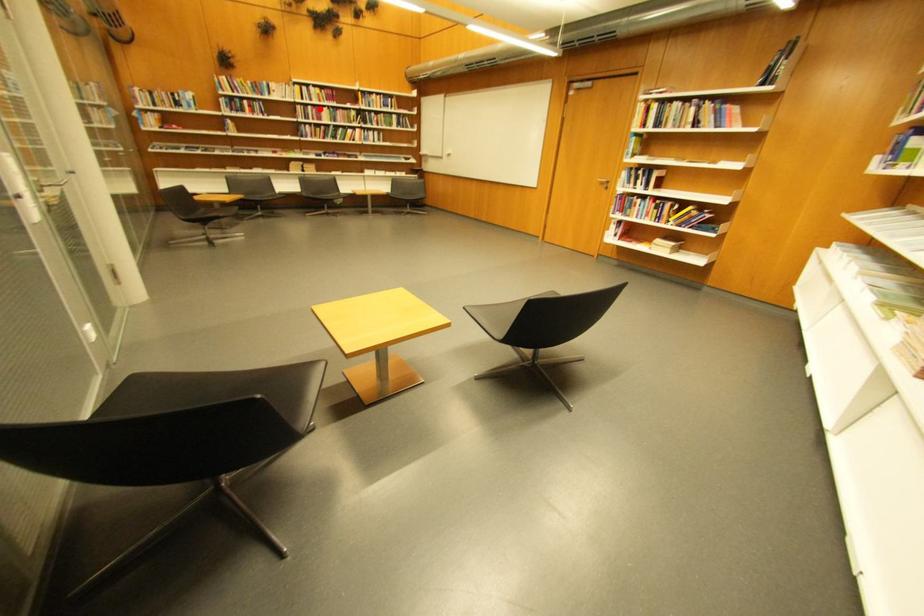
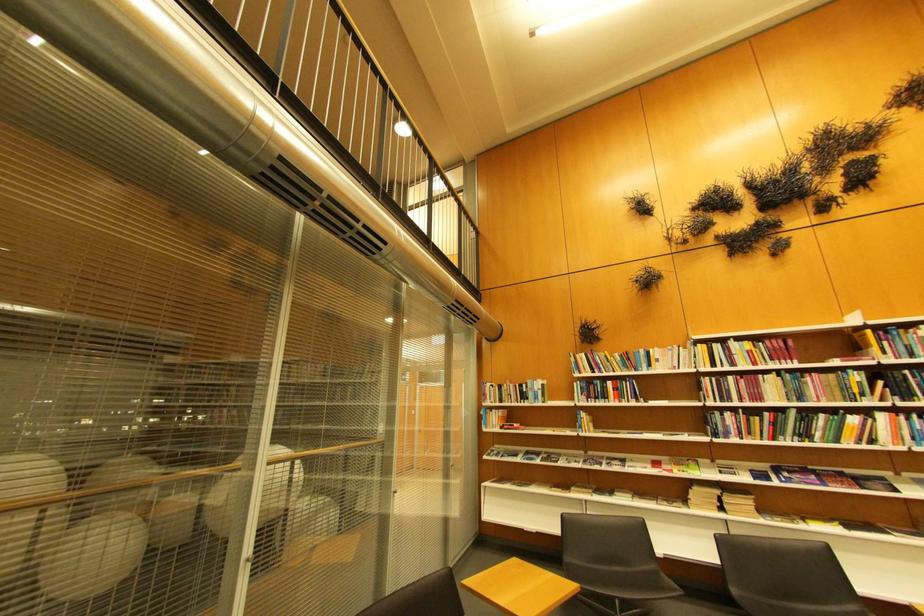
Where in the second image is the point corresponding to the highlighted location from the first image?

(740, 379)